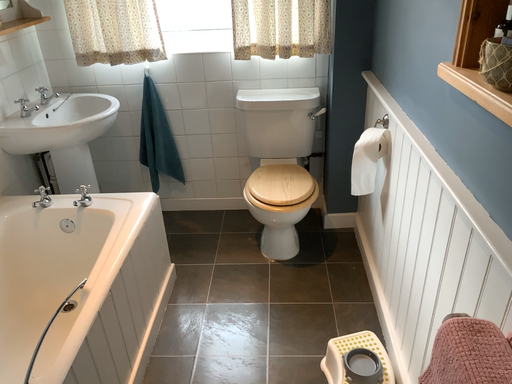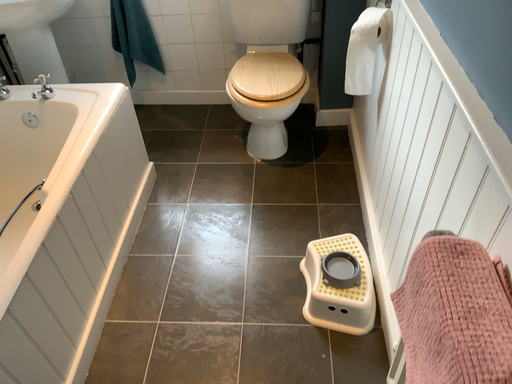
Question: How did the camera likely rotate when shooting the video?

Choices:
 (A) rotated upward
 (B) rotated downward

Answer: (B)